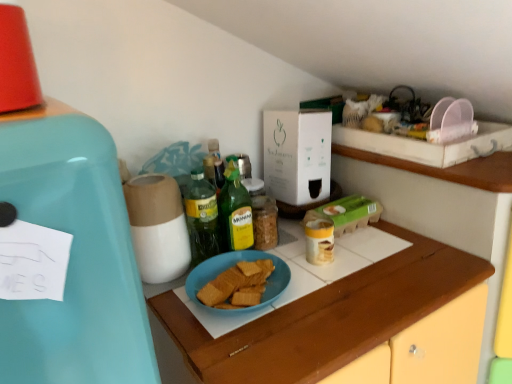
Question: Is green glass bottle at center, which is the 1th bottle from right to left, wider or thinner than blue matte plate at center?

Choices:
 (A) wide
 (B) thin

Answer: (B)

Question: From their relative heights in the image, would you say green glass bottle at center, positioned as the second bottle in left-to-right order, is taller or shorter than blue matte plate at center?

Choices:
 (A) tall
 (B) short

Answer: (B)

Question: Which of these objects is positioned farthest from the green glass bottle at center, positioned as the second bottle in left-to-right order?

Choices:
 (A) blue matte plate at center
 (B) teal matte refrigerator at left
 (C) white cardboard box at center
 (D) green glass bottle at center, which is counted as the 2th bottle, starting from the right
 (E) blue matte plate at center

Answer: (B)

Question: Which is farther from the green glass bottle at center, which is the 1th bottle from right to left?

Choices:
 (A) teal matte refrigerator at left
 (B) green glass bottle at center, which is counted as the first bottle, starting from the left
 (C) blue matte plate at center
 (D) blue matte plate at center
 (E) white cardboard box at center

Answer: (A)